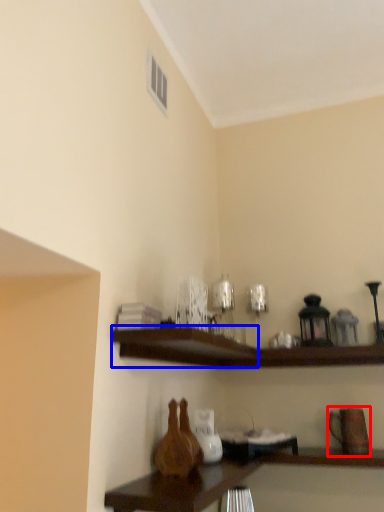
Question: Which object is further to the camera taking this photo, pottery (highlighted by a red box) or shelf (highlighted by a blue box)?

Choices:
 (A) pottery
 (B) shelf

Answer: (A)